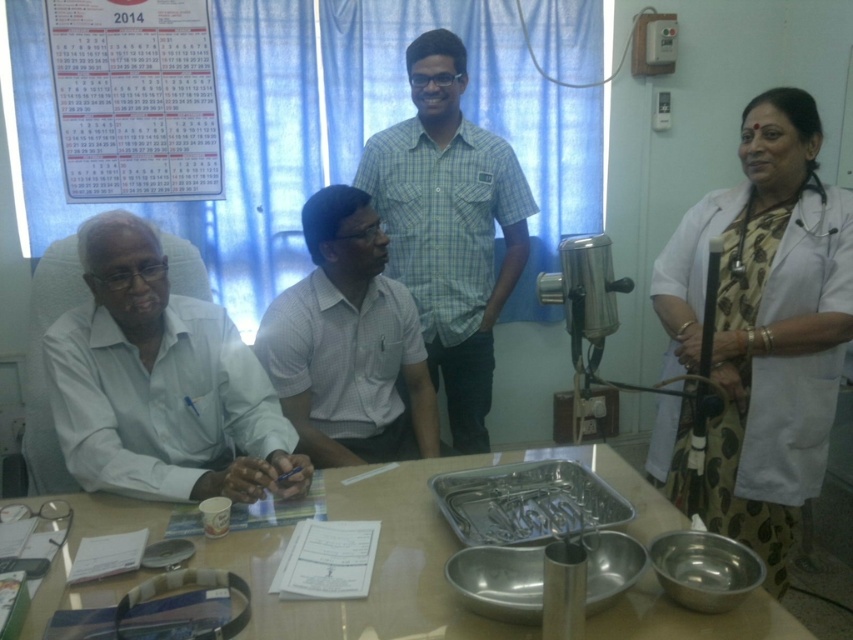
Is metallic table at center above green checkered shirt at center?

Actually, metallic table at center is below green checkered shirt at center.

Does metallic table at center have a greater width compared to green checkered shirt at center?

Yes, metallic table at center is wider than green checkered shirt at center.

Locate an element on the screen. This screenshot has height=640, width=853. metallic table at center is located at coordinates (373, 566).

Can you confirm if white matte shirt at left is wider than silver metallic tray at center?

Correct, the width of white matte shirt at left exceeds that of silver metallic tray at center.

Who is more distant from viewer, (234, 465) or (538, 497)?

The point (538, 497) is behind.

Describe the element at coordinates (160, 384) in the screenshot. I see `white matte shirt at left` at that location.

At what (x,y) coordinates should I click in order to perform the action: click on white matte shirt at left. Please return your answer as a coordinate pair (x, y). This screenshot has width=853, height=640. Looking at the image, I should click on (160, 384).

What do you see at coordinates (450, 227) in the screenshot? I see `green checkered shirt at center` at bounding box center [450, 227].

Identify the location of green checkered shirt at center. (450, 227).

Consider the image. Who is more distant from viewer, (x=483, y=390) or (x=352, y=289)?

→ The point (x=483, y=390) is behind.

Where is `green checkered shirt at center`? green checkered shirt at center is located at coordinates (450, 227).